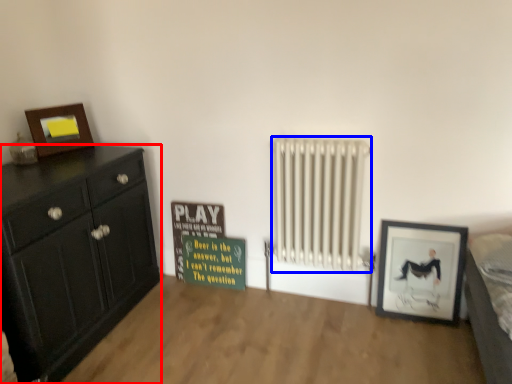
Question: Which point is closer to the camera, chest of drawers (highlighted by a red box) or radiator (highlighted by a blue box)?

Choices:
 (A) chest of drawers
 (B) radiator

Answer: (A)